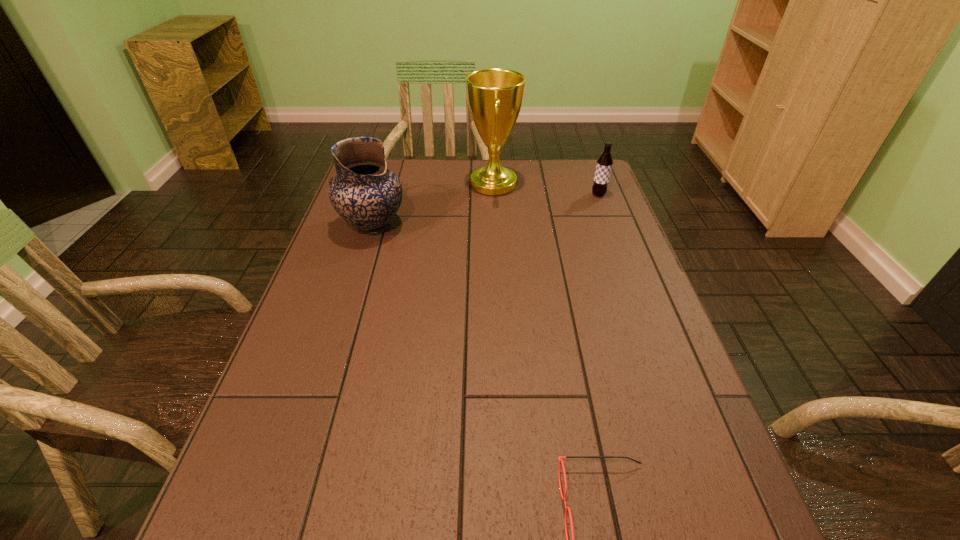
Find the location of `vacant space situated 0.210m on the left of the third tallest object`. vacant space situated 0.210m on the left of the third tallest object is located at coordinates (525, 194).

Identify the location of award present at the far edge. (495, 96).

This screenshot has height=540, width=960. I want to click on root beer that is positioned at the far edge, so click(x=604, y=164).

Identify the location of object present at the left edge. The height and width of the screenshot is (540, 960). (365, 193).

Identify the location of object that is at the right edge. This screenshot has height=540, width=960. (604, 164).

Where is `object that is positioned at the far right corner`? The width and height of the screenshot is (960, 540). object that is positioned at the far right corner is located at coordinates (604, 164).

Where is `free space at the far edge of the desktop`? The image size is (960, 540). free space at the far edge of the desktop is located at coordinates (468, 180).

This screenshot has width=960, height=540. What are the coordinates of `vacant space at the left edge of the desktop` in the screenshot? It's located at (339, 407).

This screenshot has height=540, width=960. I want to click on vacant space at the right edge of the desktop, so click(x=649, y=327).

This screenshot has height=540, width=960. Identify the location of free space between the third shortest object and the third tallest object. (486, 210).